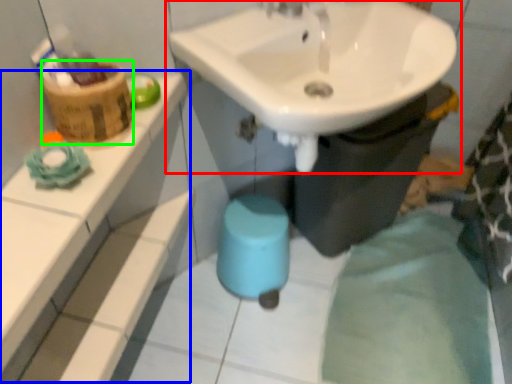
Question: Estimate the real-world distances between objects in this image. Which object is closer to sink (highlighted by a red box), balustrade (highlighted by a blue box) or basket (highlighted by a green box)?

Choices:
 (A) balustrade
 (B) basket

Answer: (B)